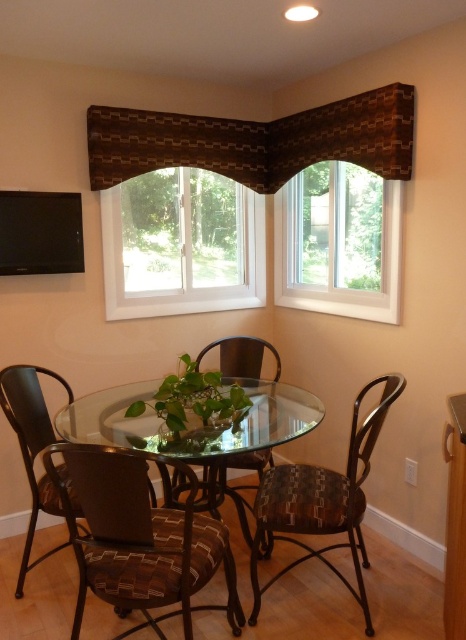
You are a painter standing in front of the dining area and want to paint the brown textured valance at upper center and the green matte plant at center. Which object should you focus on first to capture their details accurately?

The brown textured valance at upper center is closer to you than the green matte plant at center, so you should focus on painting the brown textured valance at upper center first to capture its details accurately before moving to the background where the green matte plant at center is located.

You are a delivery person trying to place a large rectangular box that is 1.5 meters long on the floor. The box needs to be placed between the transparent glass table at center and the viewer. Is there enough space for the box to fit without touching the table or the viewer?

The transparent glass table at center and viewer are 1.51 meters apart. Since the box is 1.5 meters long, there is enough space between them to place the box without it touching either the table or the viewer.